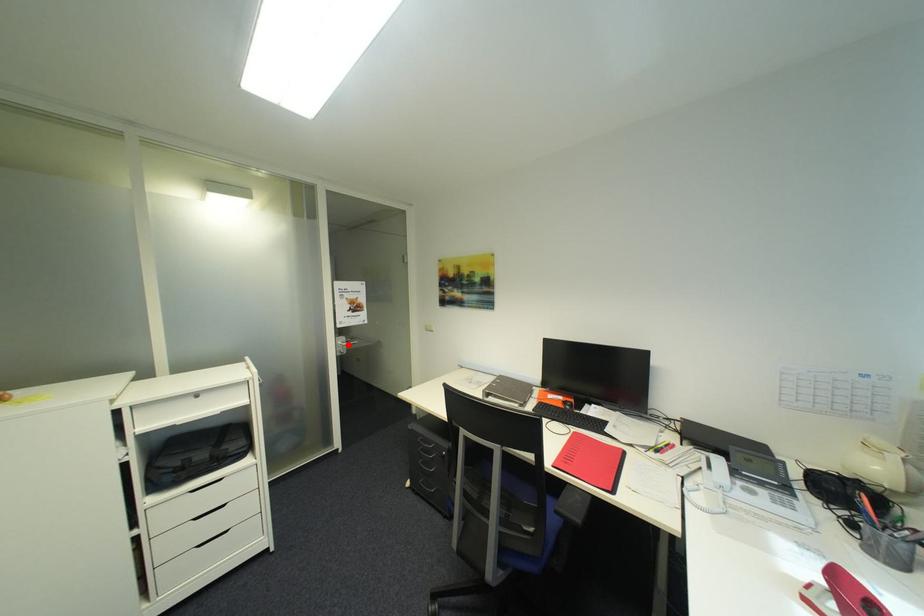
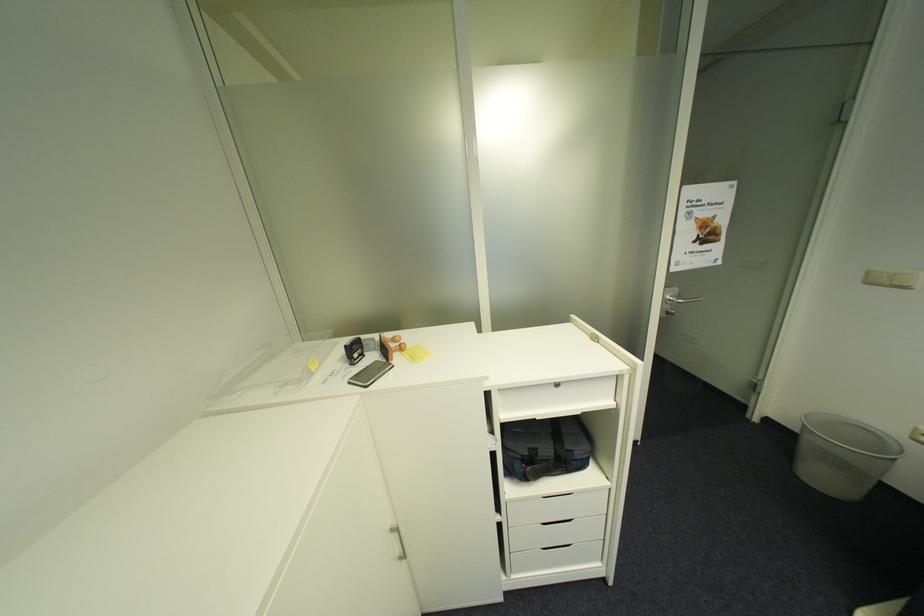
Locate, in the second image, the point that corresponds to the highlighted location in the first image.

(676, 301)